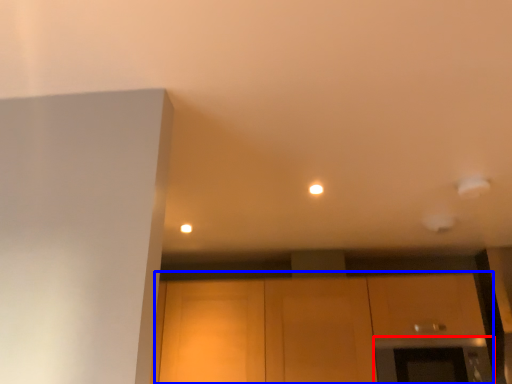
Question: Which of the following is the closest to the observer, oven (highlighted by a red box) or cabinetry (highlighted by a blue box)?

Choices:
 (A) oven
 (B) cabinetry

Answer: (A)